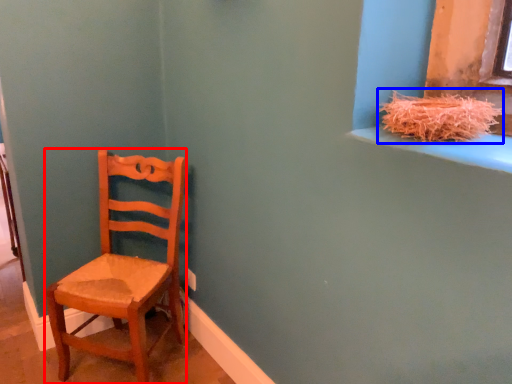
Question: Among these objects, which one is nearest to the camera, chair (highlighted by a red box) or straw (highlighted by a blue box)?

Choices:
 (A) chair
 (B) straw

Answer: (B)